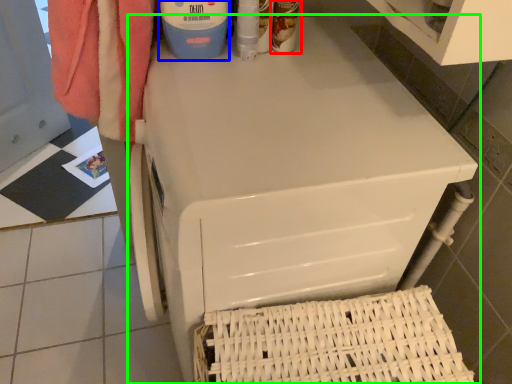
Question: Based on their relative distances, which object is nearer to cleaning product (highlighted by a red box)? Choose from cleaning product (highlighted by a blue box) and home appliance (highlighted by a green box).

Choices:
 (A) cleaning product
 (B) home appliance

Answer: (A)